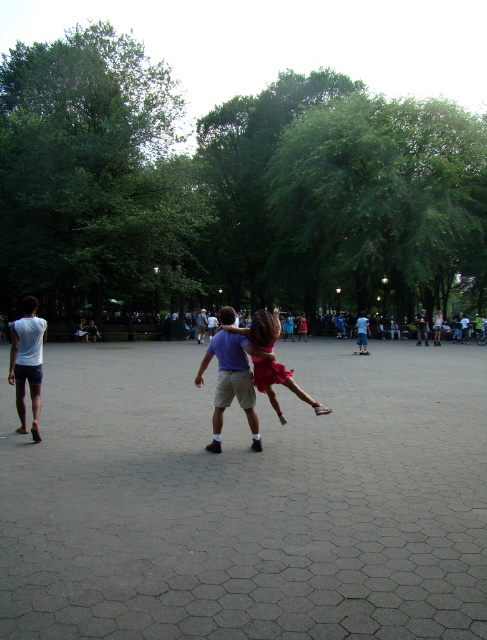
You are a photographer trying to capture a photo of the matte purple shirt at center and the matte red dress at center. Since you want both subjects to be clearly visible, which one should you focus on first to ensure proper depth of field?

The matte purple shirt at center is taller than the matte red dress at center, so focusing on the taller subject first will help ensure both are in focus.

You are a photographer trying to capture a group photo of the matte purple shirt at center and the matte red dress at center. Since you want to ensure both subjects are fully visible in the frame, which subject should you adjust the camera focus to prioritize based on their sizes?

The matte purple shirt at center is wider than the matte red dress at center. Therefore, to ensure both are fully visible, the camera focus should prioritize the matte purple shirt at center due to its larger size.